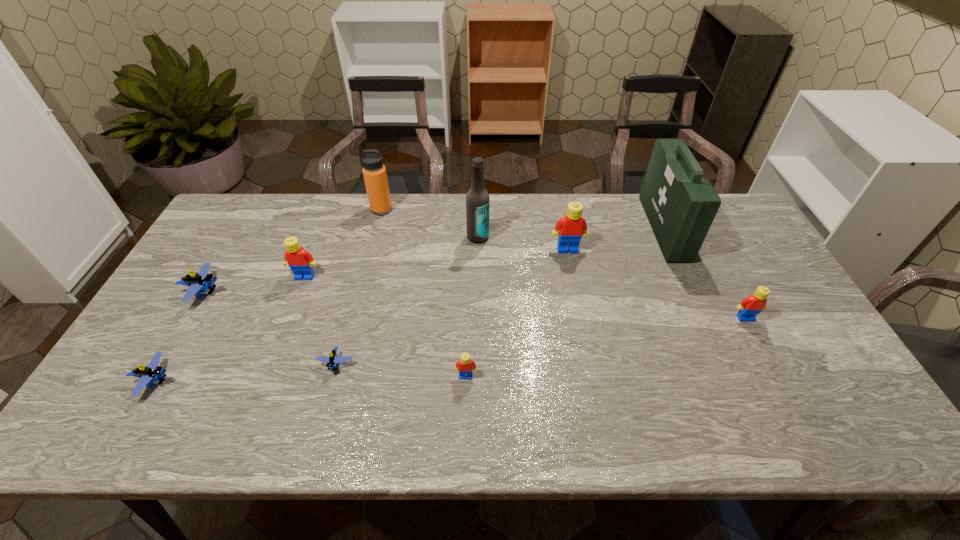
Identify the location of the first-aid kit present at the far edge. (680, 205).

Image resolution: width=960 pixels, height=540 pixels. I want to click on thermos bottle that is at the far edge, so click(x=374, y=172).

Identify the location of object positioned at the right edge. The image size is (960, 540). (750, 306).

The image size is (960, 540). What are the coordinates of `vacant space at the far edge of the desktop` in the screenshot? It's located at (636, 224).

Identify the location of vacant space at the near edge of the desktop. (620, 407).

Identify the location of free space at the left edge. (209, 299).

The height and width of the screenshot is (540, 960). In the image, there is a desktop. In order to click on vacant space at the right edge in this screenshot , I will do `click(756, 322)`.

What are the coordinates of `free space at the near right corner of the desktop` in the screenshot? It's located at (832, 439).

At what (x,y) coordinates should I click in order to perform the action: click on vacant space in between the third red Lego from left to right and the beer bottle. Please return your answer as a coordinate pair (x, y). The image size is (960, 540). Looking at the image, I should click on (522, 243).

Locate an element on the screen. vacant region between the third tallest object and the second smallest blue Lego is located at coordinates (269, 295).